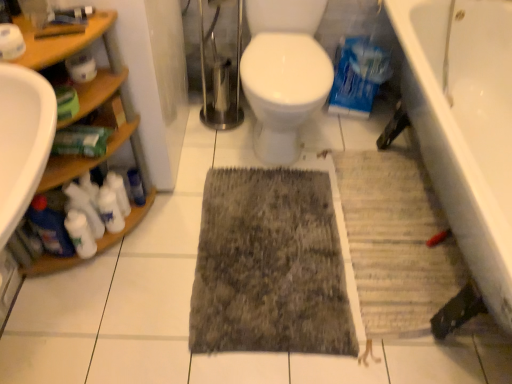
Question: From a real-world perspective, does white matte toilet paper at upper left, acting as the second toilet paper starting from the right, sit lower than white matte cleaning product at left, placed as the 4th cleaning product when sorted from left to right?

Choices:
 (A) yes
 (B) no

Answer: (B)

Question: Can you confirm if white matte toilet paper at upper left, the first toilet paper viewed from the left, is taller than white matte cleaning product at left, the 1th cleaning product from the right?

Choices:
 (A) no
 (B) yes

Answer: (A)

Question: Is white matte toilet paper at upper left, the 1th toilet paper when ordered from front to back, far from white matte cleaning product at left, placed as the 4th cleaning product when sorted from left to right?

Choices:
 (A) yes
 (B) no

Answer: (B)

Question: Would you say white matte toilet paper at upper left, acting as the 2th toilet paper starting from the back, contains white matte cleaning product at left, placed as the 4th cleaning product when sorted from left to right?

Choices:
 (A) yes
 (B) no

Answer: (B)

Question: Is white matte toilet paper at upper left, the 1th toilet paper when ordered from front to back, positioned before white matte cleaning product at left, the 1th cleaning product from the right?

Choices:
 (A) yes
 (B) no

Answer: (A)

Question: Is white matte toilet paper at upper left, acting as the 2th toilet paper starting from the back, smaller than white matte cleaning product at left, the 1th cleaning product from the right?

Choices:
 (A) yes
 (B) no

Answer: (A)

Question: Is gray textured bath mat at lower right wider than dark gray textured rug at center?

Choices:
 (A) yes
 (B) no

Answer: (B)

Question: Does gray textured bath mat at lower right have a lesser width compared to dark gray textured rug at center?

Choices:
 (A) no
 (B) yes

Answer: (B)

Question: From the image's perspective, is gray textured bath mat at lower right above dark gray textured rug at center?

Choices:
 (A) yes
 (B) no

Answer: (A)

Question: Considering the relative sizes of gray textured bath mat at lower right and dark gray textured rug at center in the image provided, is gray textured bath mat at lower right taller than dark gray textured rug at center?

Choices:
 (A) yes
 (B) no

Answer: (A)

Question: Could dark gray textured rug at center be considered to be inside gray textured bath mat at lower right?

Choices:
 (A) yes
 (B) no

Answer: (B)

Question: Is dark gray textured rug at center at the back of gray textured bath mat at lower right?

Choices:
 (A) yes
 (B) no

Answer: (B)

Question: Can you confirm if white matte cleaning products at lower left, which is the second cleaning product in right-to-left order, is taller than white matte toilet paper at upper left, acting as the second toilet paper starting from the right?

Choices:
 (A) yes
 (B) no

Answer: (A)